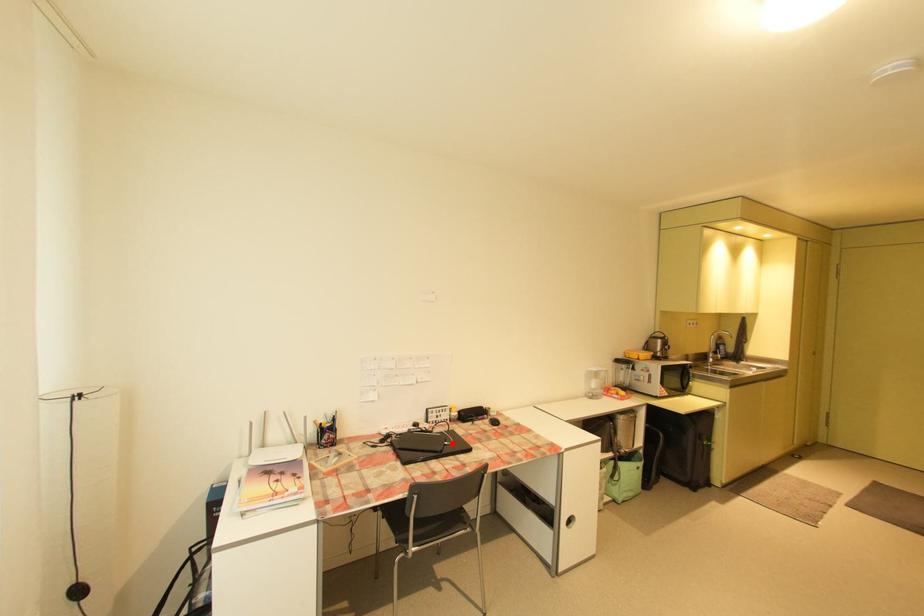
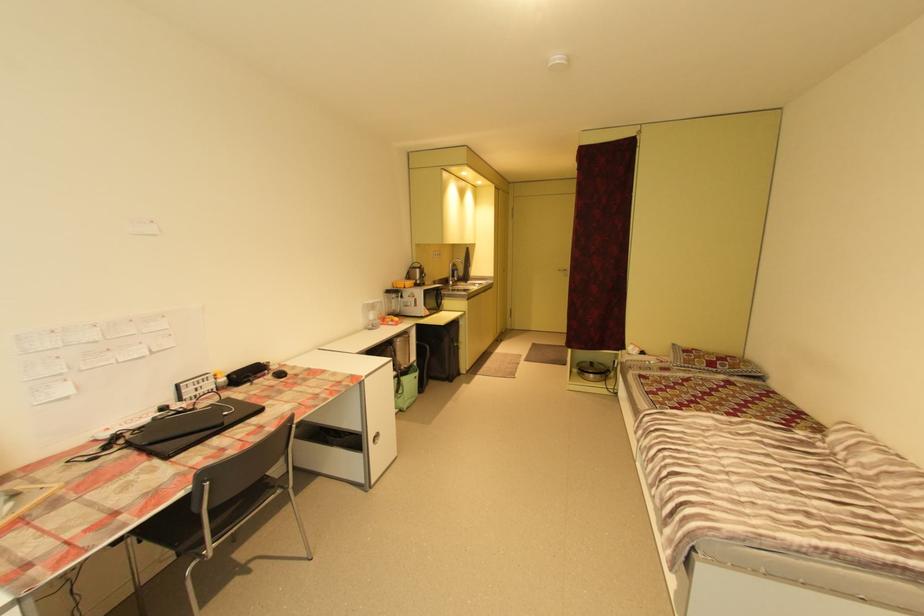
In the second image, find the point that corresponds to the highlighted location in the first image.

(232, 414)